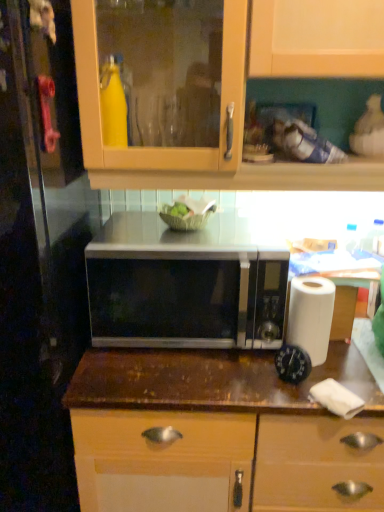
Question: Which is correct: satin silver microwave at center is inside white paper at right, or outside of it?

Choices:
 (A) outside
 (B) inside

Answer: (A)

Question: Is satin silver microwave at center wider or thinner than white paper at right?

Choices:
 (A) wide
 (B) thin

Answer: (A)

Question: Which object is positioned closest to the white paper towel at lower right?

Choices:
 (A) transparent glass door at left
 (B) satin silver microwave at center
 (C) brown wood countertop at center
 (D) white paper at right

Answer: (D)

Question: Which is farther from the white paper towel at lower right?

Choices:
 (A) white paper at right
 (B) satin silver microwave at center
 (C) transparent glass door at left
 (D) brown wood countertop at center

Answer: (C)